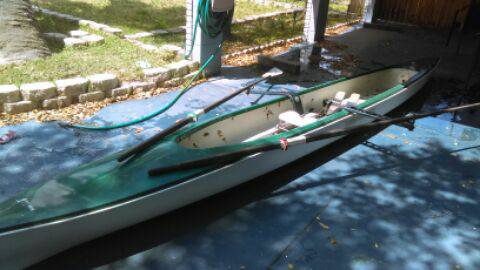
Image resolution: width=480 pixels, height=270 pixels. Identify the location of brick pillar. (203, 52), (320, 25), (367, 13).